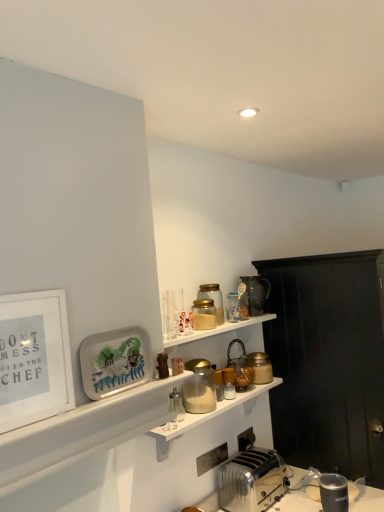
The width and height of the screenshot is (384, 512). What do you see at coordinates (162, 365) in the screenshot?
I see `brown leather wallet at upper center, which appears as the 10th appliance when viewed from the back` at bounding box center [162, 365].

This screenshot has width=384, height=512. What do you see at coordinates (200, 388) in the screenshot? I see `matte gold jar at center, acting as the fourth appliance starting from the front` at bounding box center [200, 388].

Find the location of a particular element. matte gold jar at center, the 7th appliance in the back-to-front sequence is located at coordinates (200, 388).

Measure the distance between translucent glass jar at upper center, which ranks as the 5th appliance in front-to-back order, and camera.

translucent glass jar at upper center, which ranks as the 5th appliance in front-to-back order, is 6.19 feet away from camera.

This screenshot has height=512, width=384. I want to click on white glossy shelf at lower left, marked as the second shelf in a bottom-to-top arrangement, so [82, 432].

What is the approximate width of white glossy shelf at lower left, the second shelf in the top-to-bottom sequence?

The width of white glossy shelf at lower left, the second shelf in the top-to-bottom sequence, is 11.56 inches.

What do you see at coordinates (233, 306) in the screenshot?
I see `clear glass jar at upper center, which is the eighth appliance from front to back` at bounding box center [233, 306].

What is the approximate height of metallic gold faucet at upper center, the seventh appliance positioned from the front?

9.81 inches.

What are the coordinates of `metallic gold faucet at upper center, acting as the fourth appliance starting from the back` in the screenshot? It's located at (240, 366).

At what (x,y) coordinates should I click in order to perform the action: click on brown leather wallet at upper center, which ranks as the 1th appliance in front-to-back order. Please return your answer as a coordinate pair (x, y). Looking at the image, I should click on [162, 365].

From the image's perspective, which object appears higher, brown leather wallet at upper center, which ranks as the 1th appliance in front-to-back order, or white glossy shelf at lower left, marked as the second shelf in a bottom-to-top arrangement?

brown leather wallet at upper center, which ranks as the 1th appliance in front-to-back order, from the image's perspective.

Which object is further away from the camera, brown leather wallet at upper center, which ranks as the 1th appliance in front-to-back order, or white glossy shelf at lower left, the second shelf in the top-to-bottom sequence?

brown leather wallet at upper center, which ranks as the 1th appliance in front-to-back order, is behind.

Is brown leather wallet at upper center, which appears as the 10th appliance when viewed from the back, at the right side of white glossy shelf at lower left, marked as the second shelf in a bottom-to-top arrangement?

Correct, you'll find brown leather wallet at upper center, which appears as the 10th appliance when viewed from the back, to the right of white glossy shelf at lower left, marked as the second shelf in a bottom-to-top arrangement.

Considering the positions of point (165, 375) and point (53, 462), is point (165, 375) closer or farther from the camera than point (53, 462)?

Point (165, 375).

Is point (177, 393) farther from camera compared to point (184, 428)?

No, (177, 393) is in front of (184, 428).

Can you confirm if clear glass salt shaker at center, which is the 9th appliance in back-to-front order, is wider than matte glass jars at center, the 3th shelf from the top?

In fact, clear glass salt shaker at center, which is the 9th appliance in back-to-front order, might be narrower than matte glass jars at center, the 3th shelf from the top.

Is clear glass salt shaker at center, which is the 9th appliance in back-to-front order, looking in the opposite direction of matte glass jars at center, the 3th shelf from the top?

No, clear glass salt shaker at center, which is the 9th appliance in back-to-front order, is not facing away from matte glass jars at center, the 3th shelf from the top.

Is clear glass salt shaker at center, positioned as the second appliance in front-to-back order, inside the boundaries of metallic silver toaster at lower right, the 8th appliance positioned from the back, or outside?

clear glass salt shaker at center, positioned as the second appliance in front-to-back order, is spatially situated outside metallic silver toaster at lower right, the 8th appliance positioned from the back.

In the scene shown: Considering the sizes of objects clear glass salt shaker at center, positioned as the second appliance in front-to-back order, and metallic silver toaster at lower right, the 8th appliance positioned from the back, in the image provided, who is smaller, clear glass salt shaker at center, positioned as the second appliance in front-to-back order, or metallic silver toaster at lower right, the 8th appliance positioned from the back,?

Smaller between the two is clear glass salt shaker at center, positioned as the second appliance in front-to-back order.

From a real-world perspective, which object rests below the other?

In real-world perspective, metallic silver toaster at lower right, the 8th appliance positioned from the back, is lower.

Which is more to the right, clear glass salt shaker at center, positioned as the second appliance in front-to-back order, or metallic silver toaster at lower right, the 8th appliance positioned from the back?

metallic silver toaster at lower right, the 8th appliance positioned from the back.

Where is `the 1st appliance in front of the metallic silver toaster at lower right, the 8th appliance positioned from the back`? This screenshot has width=384, height=512. the 1st appliance in front of the metallic silver toaster at lower right, the 8th appliance positioned from the back is located at coordinates (176, 405).

Between metallic silver toaster at lower right, the 8th appliance positioned from the back, and clear glass salt shaker at center, positioned as the second appliance in front-to-back order, which one is positioned behind?

metallic silver toaster at lower right, the 8th appliance positioned from the back, is more distant.

From a real-world perspective, is metallic silver toaster at lower right, the third appliance in the front-to-back sequence, above or below clear glass salt shaker at center, which is the 9th appliance in back-to-front order?

From a real-world perspective, metallic silver toaster at lower right, the third appliance in the front-to-back sequence, is physically below clear glass salt shaker at center, which is the 9th appliance in back-to-front order.

Is metallic silver toaster at lower right, the third appliance in the front-to-back sequence, with clear glass salt shaker at center, positioned as the second appliance in front-to-back order?

No, metallic silver toaster at lower right, the third appliance in the front-to-back sequence, is not next to clear glass salt shaker at center, positioned as the second appliance in front-to-back order.

In the scene shown: Does white matte picture frame at left, the 2th picture frame positioned from the back, have a larger size compared to silver metallic toaster at lower center?

Actually, white matte picture frame at left, the 2th picture frame positioned from the back, might be smaller than silver metallic toaster at lower center.

Between point (64, 300) and point (249, 473), which one is positioned in front?

Positioned in front is point (64, 300).

Is white matte picture frame at left, which is the 1th picture frame from front to back, outside of silver metallic toaster at lower center?

Yes, white matte picture frame at left, which is the 1th picture frame from front to back, is outside of silver metallic toaster at lower center.

You are a GUI agent. You are given a task and a screenshot of the screen. Output one action in this format:
    pyautogui.click(x=<x>, y=<y>)
    Task: Click on the 2nd picture frame in front when counting from the silver metallic toaster at lower center
    The height and width of the screenshot is (512, 384).
    Given the screenshot: What is the action you would take?
    pyautogui.click(x=39, y=357)

Does point (106, 385) lie behind point (177, 407)?

No, (106, 385) is in front of (177, 407).

Consider the image. Who is bigger, matte plastic tray at lower left, the second picture frame in the front-to-back sequence, or clear glass salt shaker at center, positioned as the second appliance in front-to-back order?

matte plastic tray at lower left, the second picture frame in the front-to-back sequence, is bigger.

Identify the location of the 2nd appliance to the right of the matte plastic tray at lower left, placed as the first picture frame when sorted from right to left, starting your count from the anchor. The width and height of the screenshot is (384, 512). (176, 405).

Is clear glass salt shaker at center, which is the 9th appliance in back-to-front order, at the back of matte plastic tray at lower left, the first picture frame positioned from the back?

No.

Is matte plastic tray at lower left, the second picture frame in the front-to-back sequence, closer to the viewer compared to brown leather wallet at upper center, which ranks as the 1th appliance in front-to-back order?

Yes.

Considering the sizes of objects matte plastic tray at lower left, placed as the first picture frame when sorted from right to left, and brown leather wallet at upper center, which ranks as the 1th appliance in front-to-back order, in the image provided, who is bigger, matte plastic tray at lower left, placed as the first picture frame when sorted from right to left, or brown leather wallet at upper center, which ranks as the 1th appliance in front-to-back order,?

Bigger between the two is matte plastic tray at lower left, placed as the first picture frame when sorted from right to left.

Consider the image. How many degrees apart are the facing directions of matte plastic tray at lower left, which is the 2th picture frame from left to right, and brown leather wallet at upper center, which ranks as the 1th appliance in front-to-back order?

1.19 degrees.

Looking at this image, considering the sizes of matte plastic tray at lower left, which is the 2th picture frame from left to right, and brown leather wallet at upper center, which ranks as the 1th appliance in front-to-back order, in the image, is matte plastic tray at lower left, which is the 2th picture frame from left to right, wider or thinner than brown leather wallet at upper center, which ranks as the 1th appliance in front-to-back order,?

In the image, matte plastic tray at lower left, which is the 2th picture frame from left to right, appears to be more narrow than brown leather wallet at upper center, which ranks as the 1th appliance in front-to-back order.

Find the location of a particular element. The width and height of the screenshot is (384, 512). shelf in front of the brown leather wallet at upper center, which ranks as the 1th appliance in front-to-back order is located at coordinates (82, 432).

The height and width of the screenshot is (512, 384). Find the location of `appliance that is the 4th object to the left of the matte glass jars at center, arranged as the first shelf when ordered from the bottom, starting at the anchor`. appliance that is the 4th object to the left of the matte glass jars at center, arranged as the first shelf when ordered from the bottom, starting at the anchor is located at coordinates (176, 405).

From the image, which object appears to be nearer to silver metallic toaster at lower center, matte gold jar at upper right, the second appliance from the back, or white matte picture frame at left, which is the 1th picture frame from front to back?

matte gold jar at upper right, the second appliance from the back, is positioned closer to the anchor silver metallic toaster at lower center.

Considering their positions, is brown leather wallet at upper center, which appears as the 10th appliance when viewed from the back, positioned closer to matte gold jar at upper right, the second appliance from the back, than metallic silver toaster at lower right, the third appliance in the front-to-back sequence?

metallic silver toaster at lower right, the third appliance in the front-to-back sequence.

Estimate the real-world distances between objects in this image. Which object is closer to white matte picture frame at left, which is the 1th picture frame from front to back, clear glass salt shaker at center, positioned as the second appliance in front-to-back order, or white glossy shelf at lower left, marked as the second shelf in a bottom-to-top arrangement?

Among the two, white glossy shelf at lower left, marked as the second shelf in a bottom-to-top arrangement, is located nearer to white matte picture frame at left, which is the 1th picture frame from front to back.

In the scene shown: Based on their spatial positions, is matte brown jug at upper right, which is the first appliance from back to front, or matte gold jar at center, acting as the fourth appliance starting from the front, further from translucent glass jar at upper center, placed as the sixth appliance when sorted from front to back?

matte gold jar at center, acting as the fourth appliance starting from the front, is further to translucent glass jar at upper center, placed as the sixth appliance when sorted from front to back.

Considering their positions, is matte brown jug at upper right, the 10th appliance viewed from the front, positioned closer to matte gold jar at center, the 7th appliance in the back-to-front sequence, than white glossy shelf at lower left, marked as the second shelf in a bottom-to-top arrangement?

Based on the image, matte brown jug at upper right, the 10th appliance viewed from the front, appears to be nearer to matte gold jar at center, the 7th appliance in the back-to-front sequence.

Looking at the image, which one is located further to white glossy shelf at lower left, the second shelf in the top-to-bottom sequence, metallic gold faucet at upper center, acting as the fourth appliance starting from the back, or silver metallic toaster at lower center?

The object further to white glossy shelf at lower left, the second shelf in the top-to-bottom sequence, is silver metallic toaster at lower center.

Looking at this image, when comparing their distances from metallic silver toaster at lower right, the 8th appliance positioned from the back, does metallic gold faucet at upper center, the seventh appliance positioned from the front, or translucent glass jar at upper center, which appears as the fifth appliance when viewed from the back, seem further?

translucent glass jar at upper center, which appears as the fifth appliance when viewed from the back, is positioned further to the anchor metallic silver toaster at lower right, the 8th appliance positioned from the back.

Based on their spatial positions, is black wood cabinet at right or matte plastic tray at lower left, placed as the first picture frame when sorted from right to left, further from metallic silver toaster at lower right, the third appliance in the front-to-back sequence?

Based on the image, matte plastic tray at lower left, placed as the first picture frame when sorted from right to left, appears to be further to metallic silver toaster at lower right, the third appliance in the front-to-back sequence.

The image size is (384, 512). Find the location of `picture frame between white matte picture frame at left, which is the 1th picture frame from front to back, and translucent glass jar at upper center, placed as the sixth appliance when sorted from front to back, from front to back`. picture frame between white matte picture frame at left, which is the 1th picture frame from front to back, and translucent glass jar at upper center, placed as the sixth appliance when sorted from front to back, from front to back is located at coordinates (115, 361).

Where is `picture frame located between white glossy shelf at lower left, the second shelf in the top-to-bottom sequence, and matte gold jar at center, acting as the fourth appliance starting from the front, in the depth direction`? This screenshot has width=384, height=512. picture frame located between white glossy shelf at lower left, the second shelf in the top-to-bottom sequence, and matte gold jar at center, acting as the fourth appliance starting from the front, in the depth direction is located at coordinates (115, 361).

Where is `picture frame between translucent glass jar at upper center, which is the sixth appliance in back-to-front order, and metallic silver toaster at lower right, the third appliance in the front-to-back sequence, in the vertical direction`? This screenshot has height=512, width=384. picture frame between translucent glass jar at upper center, which is the sixth appliance in back-to-front order, and metallic silver toaster at lower right, the third appliance in the front-to-back sequence, in the vertical direction is located at coordinates (115, 361).

Locate an element on the screen. toaster between matte gold jar at center, the 7th appliance in the back-to-front sequence, and metallic silver toaster at lower right, the third appliance in the front-to-back sequence, from left to right is located at coordinates (252, 480).